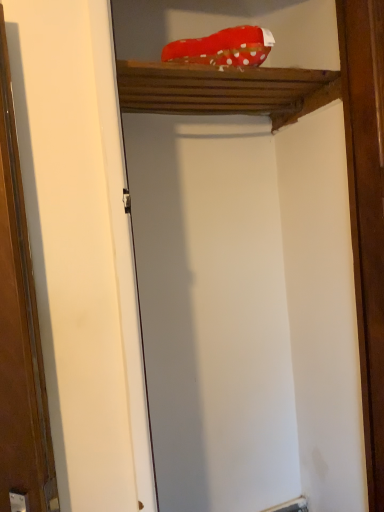
Question: Can you confirm if wooden shelf at upper center is positioned to the left of brown wood at right?

Choices:
 (A) no
 (B) yes

Answer: (B)

Question: From a real-world perspective, does wooden shelf at upper center sit lower than brown wood at right?

Choices:
 (A) no
 (B) yes

Answer: (A)

Question: From the image's perspective, is wooden shelf at upper center over brown wood at right?

Choices:
 (A) yes
 (B) no

Answer: (A)

Question: Is wooden shelf at upper center further to the viewer compared to brown wood at right?

Choices:
 (A) yes
 (B) no

Answer: (B)

Question: From a real-world perspective, does wooden shelf at upper center stand above brown wood at right?

Choices:
 (A) no
 (B) yes

Answer: (B)

Question: Does wooden shelf at upper center come in front of brown wood at right?

Choices:
 (A) no
 (B) yes

Answer: (B)

Question: Is brown wood at right bigger than wooden shelf at upper center?

Choices:
 (A) yes
 (B) no

Answer: (B)

Question: Can you confirm if brown wood at right is positioned to the right of wooden shelf at upper center?

Choices:
 (A) yes
 (B) no

Answer: (A)

Question: Is brown wood at right completely or partially outside of wooden shelf at upper center?

Choices:
 (A) no
 (B) yes

Answer: (B)

Question: Does brown wood at right have a smaller size compared to wooden shelf at upper center?

Choices:
 (A) yes
 (B) no

Answer: (A)

Question: Can you confirm if brown wood at right is shorter than wooden shelf at upper center?

Choices:
 (A) no
 (B) yes

Answer: (A)

Question: From the image's perspective, does brown wood at right appear lower than wooden shelf at upper center?

Choices:
 (A) yes
 (B) no

Answer: (A)

Question: Is point (362, 345) positioned closer to the camera than point (162, 104)?

Choices:
 (A) closer
 (B) farther

Answer: (A)